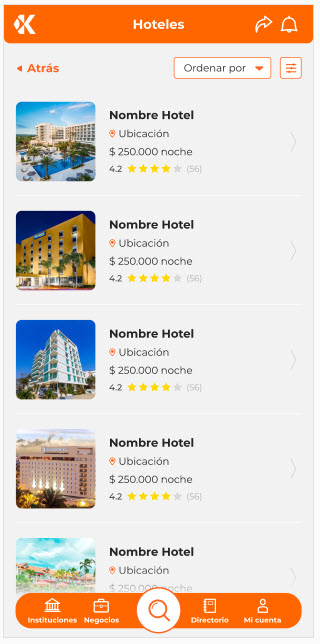
The width and height of the screenshot is (320, 644). I want to click on book, so click(x=209, y=601).